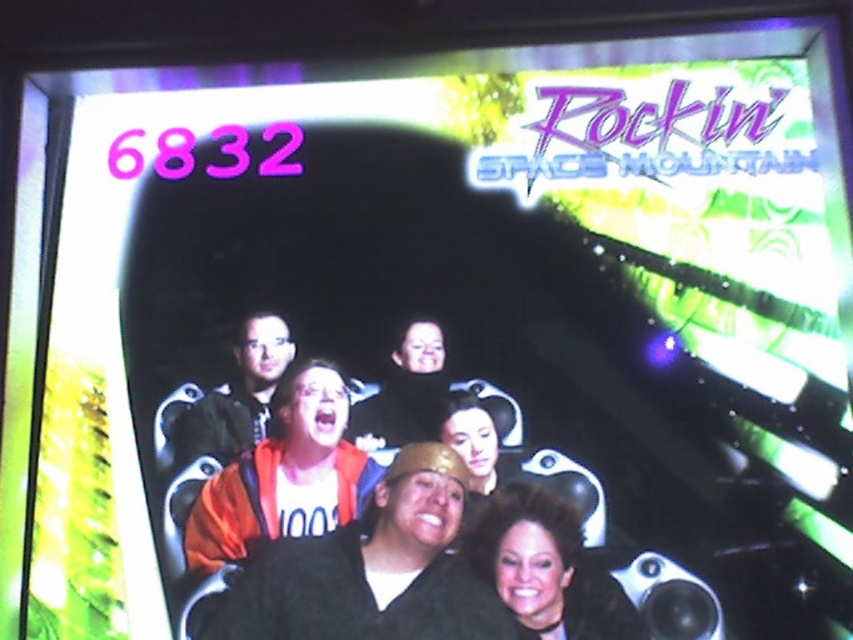
Question: Which point is farther to the camera?

Choices:
 (A) (244, 630)
 (B) (549, 554)

Answer: (B)

Question: Is black matte jacket at center to the left of shiny black hair at center from the viewer's perspective?

Choices:
 (A) yes
 (B) no

Answer: (A)

Question: Is black matte jacket at center below shiny black hair at center?

Choices:
 (A) no
 (B) yes

Answer: (B)

Question: Does black matte jacket at center have a lesser width compared to shiny black hair at center?

Choices:
 (A) no
 (B) yes

Answer: (A)